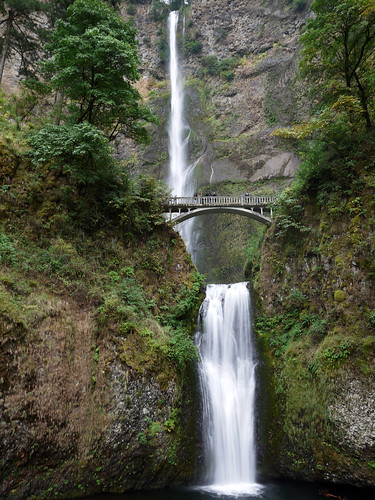
This screenshot has height=500, width=375. Find the location of `basin of water`. basin of water is located at coordinates (281, 484).